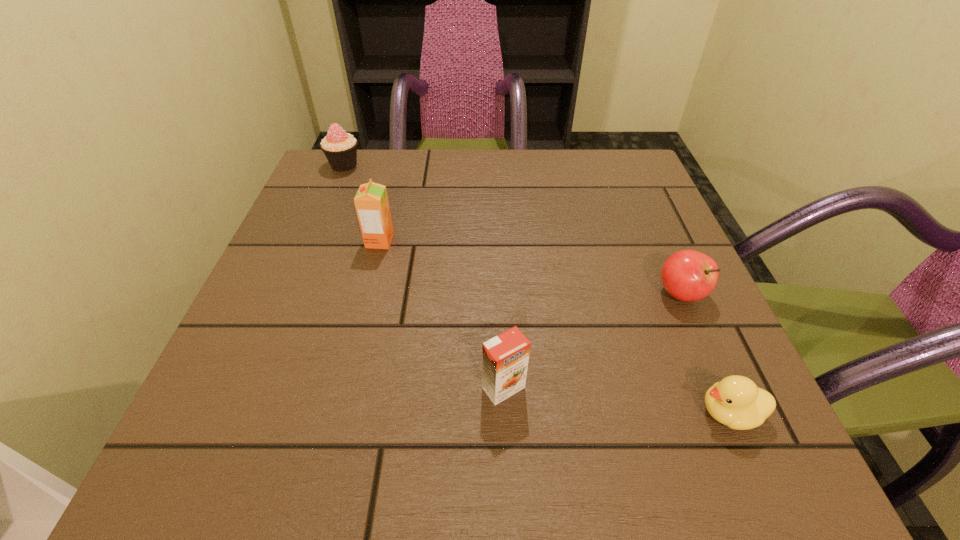
This screenshot has height=540, width=960. Find the location of `object that is at the far left corner`. object that is at the far left corner is located at coordinates [x=340, y=148].

You are a GUI agent. You are given a task and a screenshot of the screen. Output one action in this format:
    pyautogui.click(x=<x>, y=<y>)
    Task: Click on the object positioned at the near right corner
    The image size is (960, 540).
    Given the screenshot: What is the action you would take?
    pyautogui.click(x=735, y=401)

Identify the location of vacant space at the far edge of the desktop. The image size is (960, 540). (548, 153).

You are a GUI agent. You are given a task and a screenshot of the screen. Output one action in this format:
    pyautogui.click(x=<x>, y=<y>)
    Task: Click on the free space at the near edge of the desktop
    
    Given the screenshot: What is the action you would take?
    pyautogui.click(x=513, y=451)

Identify the location of vacant space at the left edge of the desktop. (273, 323).

At what (x,y) coordinates should I click in order to perform the action: click on free spot at the right edge of the desktop. Please return your answer as a coordinate pair (x, y). The height and width of the screenshot is (540, 960). Looking at the image, I should click on (640, 224).

Identify the location of vacant space at the far right corner of the desktop. pyautogui.click(x=592, y=192).

Where is `vacant space that's between the duckling and the third nearest object`? The width and height of the screenshot is (960, 540). vacant space that's between the duckling and the third nearest object is located at coordinates (706, 353).

I want to click on empty space between the third nearest object and the second farthest object, so click(x=530, y=267).

Find the location of `free space between the right orange juice and the third nearest object`. free space between the right orange juice and the third nearest object is located at coordinates (x=592, y=341).